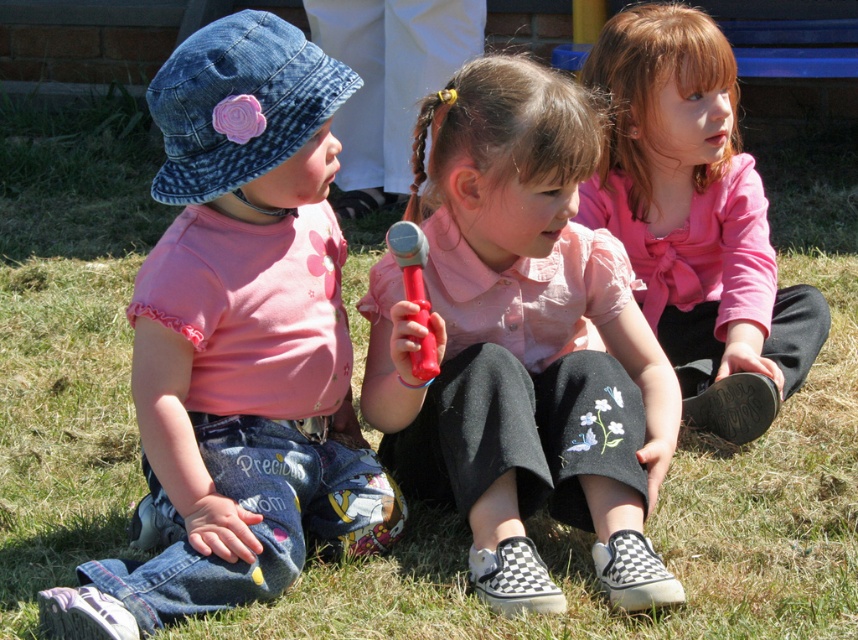
Question: Is the position of denim hat at left more distant than that of red plastic hammer at center?

Choices:
 (A) no
 (B) yes

Answer: (A)

Question: Considering the relative positions of pink fabric shirt at center and red plastic hammer at center in the image provided, where is pink fabric shirt at center located with respect to red plastic hammer at center?

Choices:
 (A) above
 (B) below

Answer: (B)

Question: Which object is farther from the camera taking this photo?

Choices:
 (A) red plastic hammer at center
 (B) denim hat at left

Answer: (A)

Question: Is denim hat at left above pink satin blouse at center?

Choices:
 (A) no
 (B) yes

Answer: (A)

Question: Among these objects, which one is nearest to the camera?

Choices:
 (A) denim hat at left
 (B) pink satin blouse at center

Answer: (A)

Question: Which object appears closest to the camera in this image?

Choices:
 (A) pink fabric shirt at center
 (B) denim hat at left

Answer: (B)